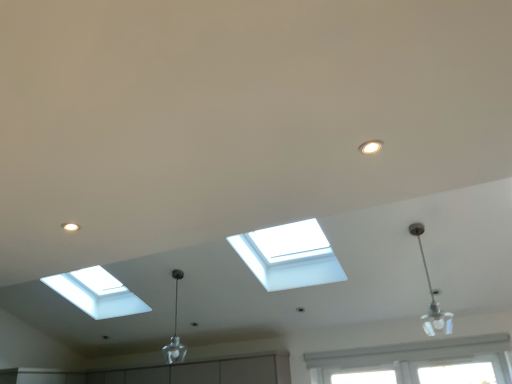
Question: Should I look upward or downward to see silver metallic pendant light at right, marked as the 2th lamp in a back-to-front arrangement?

Choices:
 (A) up
 (B) down

Answer: (B)

Question: Is clear glass pendant at center, which is counted as the first lamp, starting from the back, not inside silver metallic pendant light at right, placed as the 1th lamp when sorted from front to back?

Choices:
 (A) no
 (B) yes

Answer: (B)

Question: Can you confirm if clear glass pendant at center, which ranks as the second lamp in front-to-back order, is thinner than silver metallic pendant light at right, which appears as the 1th lamp when viewed from the right?

Choices:
 (A) yes
 (B) no

Answer: (A)

Question: Considering the relative sizes of clear glass pendant at center, which is counted as the first lamp, starting from the back, and silver metallic pendant light at right, the second lamp when ordered from left to right, in the image provided, is clear glass pendant at center, which is counted as the first lamp, starting from the back, wider than silver metallic pendant light at right, the second lamp when ordered from left to right,?

Choices:
 (A) no
 (B) yes

Answer: (A)

Question: From the image's perspective, does clear glass pendant at center, which is counted as the first lamp, starting from the back, appear lower than silver metallic pendant light at right, marked as the 2th lamp in a back-to-front arrangement?

Choices:
 (A) yes
 (B) no

Answer: (A)

Question: Does clear glass pendant at center, positioned as the second lamp in right-to-left order, have a larger size compared to silver metallic pendant light at right, placed as the 1th lamp when sorted from front to back?

Choices:
 (A) no
 (B) yes

Answer: (B)

Question: From the image's perspective, would you say clear glass pendant at center, which ranks as the second lamp in front-to-back order, is positioned over silver metallic pendant light at right, placed as the 1th lamp when sorted from front to back?

Choices:
 (A) yes
 (B) no

Answer: (B)

Question: Is silver metallic pendant light at right, which appears as the 1th lamp when viewed from the right, completely or partially outside of clear glass pendant at center, which is the 1th lamp in left-to-right order?

Choices:
 (A) yes
 (B) no

Answer: (A)

Question: Can you confirm if silver metallic pendant light at right, which appears as the 1th lamp when viewed from the right, is wider than clear glass pendant at center, which is the 1th lamp in left-to-right order?

Choices:
 (A) no
 (B) yes

Answer: (B)

Question: Is clear glass pendant at center, positioned as the second lamp in right-to-left order, at the back of silver metallic pendant light at right, the second lamp when ordered from left to right?

Choices:
 (A) yes
 (B) no

Answer: (B)

Question: Could you tell me if silver metallic pendant light at right, the second lamp when ordered from left to right, is turned towards clear glass pendant at center, which is counted as the first lamp, starting from the back?

Choices:
 (A) yes
 (B) no

Answer: (B)

Question: Would you say silver metallic pendant light at right, marked as the 2th lamp in a back-to-front arrangement, contains clear glass pendant at center, which is counted as the first lamp, starting from the back?

Choices:
 (A) no
 (B) yes

Answer: (A)

Question: Considering the relative positions of silver metallic pendant light at right, placed as the 1th lamp when sorted from front to back, and clear glass pendant at center, which ranks as the second lamp in front-to-back order, in the image provided, is silver metallic pendant light at right, placed as the 1th lamp when sorted from front to back, to the right of clear glass pendant at center, which ranks as the second lamp in front-to-back order, from the viewer's perspective?

Choices:
 (A) no
 (B) yes

Answer: (B)

Question: Is silver metallic pendant light at right, the second lamp when ordered from left to right, to the left or to the right of clear glass pendant at center, which ranks as the second lamp in front-to-back order, in the image?

Choices:
 (A) left
 (B) right

Answer: (B)